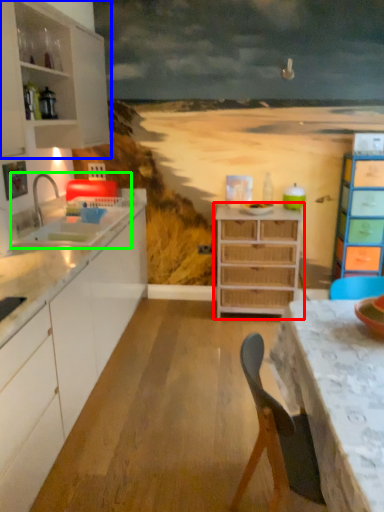
Question: Which object is positioned closest to chest of drawers (highlighted by a red box)? Select from cabinetry (highlighted by a blue box) and sink (highlighted by a green box).

Choices:
 (A) cabinetry
 (B) sink

Answer: (B)